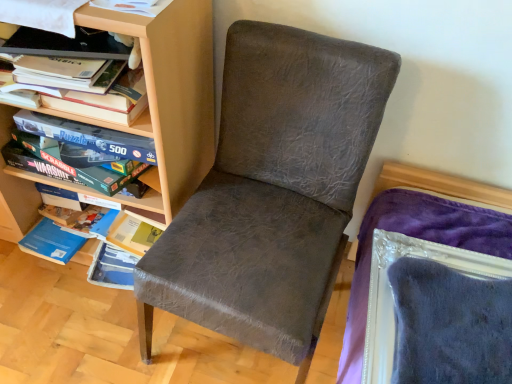
Question: From a real-world perspective, is hardcover book at upper left physically located above or below matte wood shelf at left?

Choices:
 (A) above
 (B) below

Answer: (A)

Question: From the image's perspective, is hardcover book at upper left located above or below matte wood shelf at left?

Choices:
 (A) above
 (B) below

Answer: (A)

Question: Which is nearer to the matte wood shelf at left?

Choices:
 (A) matte gray chair at center
 (B) hardcover book at upper left

Answer: (B)

Question: Considering the real-world distances, which object is farthest from the hardcover book at upper left?

Choices:
 (A) matte wood shelf at left
 (B) matte gray chair at center

Answer: (B)